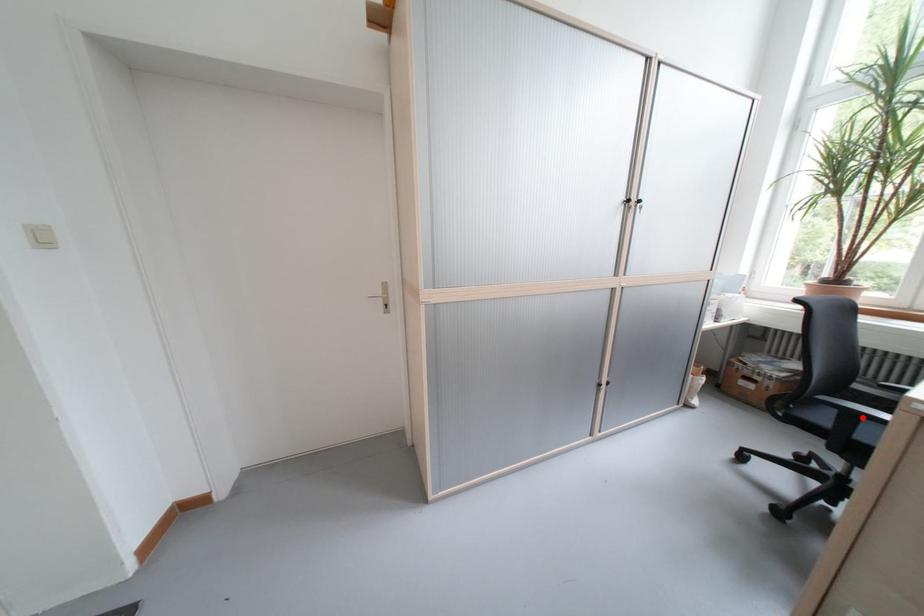
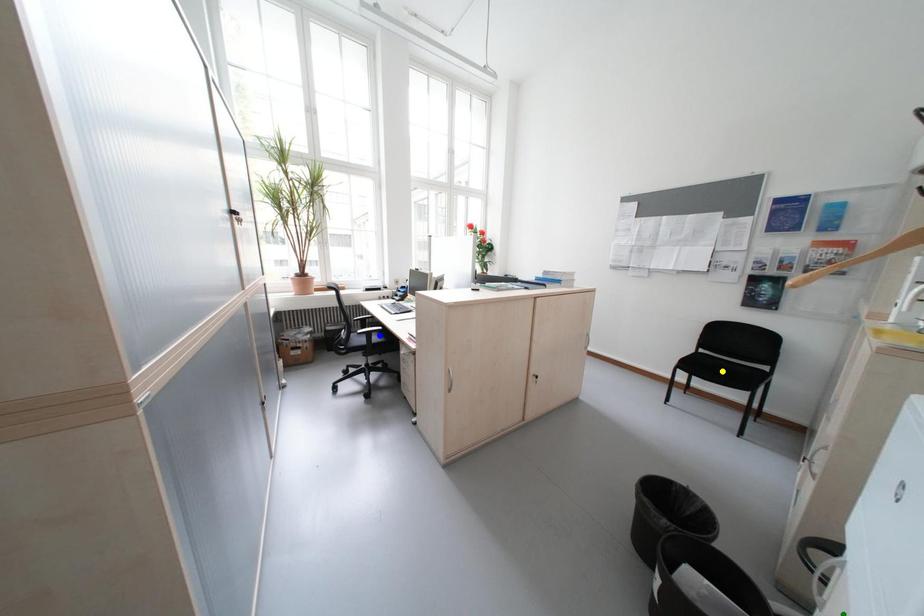
Question: I am providing you with two images of the same scene from different viewpoints. A red point is marked on the first image. You are given multiple points on the second image. Can you choose the point in image 2 that corresponds to the point in image 1?

Choices:
 (A) green point
 (B) blue point
 (C) yellow point

Answer: (B)